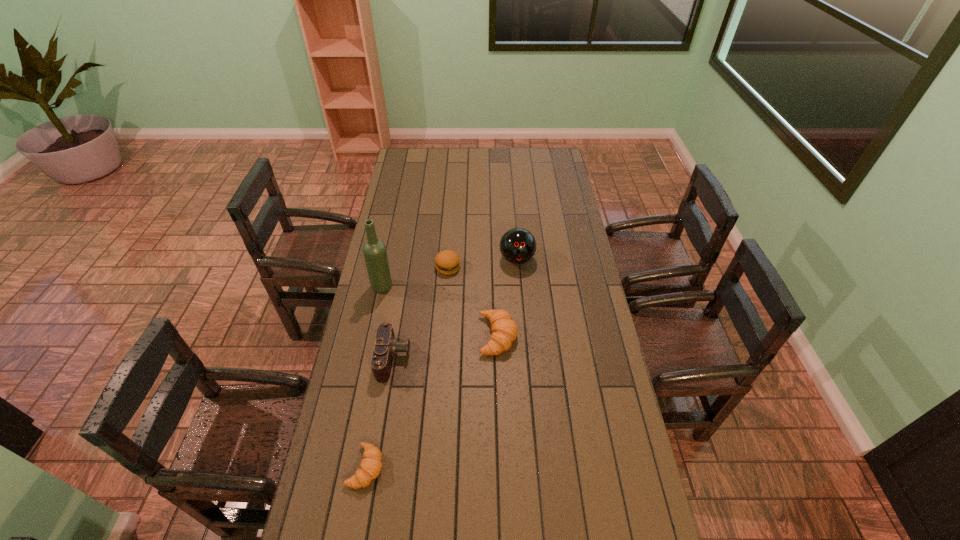
Image resolution: width=960 pixels, height=540 pixels. What are the coordinates of `blank area located 0.160m on the left of the taller crescent roll` in the screenshot? It's located at (435, 336).

Locate an element on the screen. Image resolution: width=960 pixels, height=540 pixels. free spot located on the front of the wine bottle is located at coordinates (362, 384).

At what (x,y) coordinates should I click in order to perform the action: click on vacant space located on the front-facing side of the third tallest object. Please return your answer as a coordinate pair (x, y). This screenshot has height=540, width=960. Looking at the image, I should click on (462, 359).

Find the location of a particular element. The image size is (960, 540). vacant space located 0.270m on the left of the fourth object from left to right is located at coordinates (372, 267).

I want to click on free space located 0.350m on the surface of the bowling ball near the finger holes, so click(x=524, y=341).

You are a GUI agent. You are given a task and a screenshot of the screen. Output one action in this format:
    pyautogui.click(x=<x>, y=<y>)
    Task: Click on the crescent roll located at the left edge
    
    Given the screenshot: What is the action you would take?
    pyautogui.click(x=371, y=465)

The width and height of the screenshot is (960, 540). Find the location of `wine bottle that is positioned at the left edge`. wine bottle that is positioned at the left edge is located at coordinates (374, 250).

The image size is (960, 540). Identify the location of camera that is at the left edge. click(x=386, y=346).

What are the coordinates of `vacant region at the far edge of the desktop` in the screenshot? It's located at (460, 157).

Where is `free location at the near edge of the desktop`? This screenshot has height=540, width=960. free location at the near edge of the desktop is located at coordinates [374, 501].